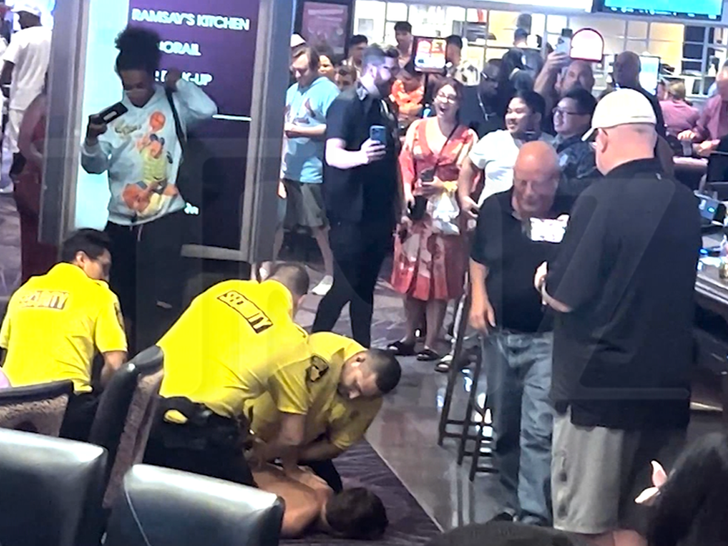
Image resolution: width=728 pixels, height=546 pixels. I want to click on floor, so click(426, 464).